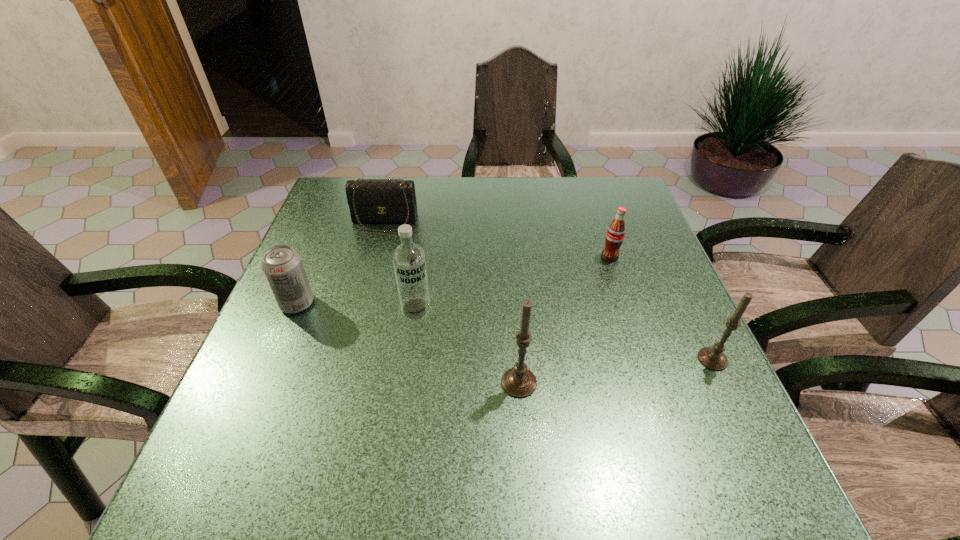
Observe the arrangement of all candles in the image. To keep them evenly spaced, where would you place another candle on the left? Please locate a free space. Please provide its 2D coordinates. Your answer should be formatted as a tuple, i.e. [(x, y)], where the tuple contains the x and y coordinates of a point satisfying the conditions above.

[(306, 408)]